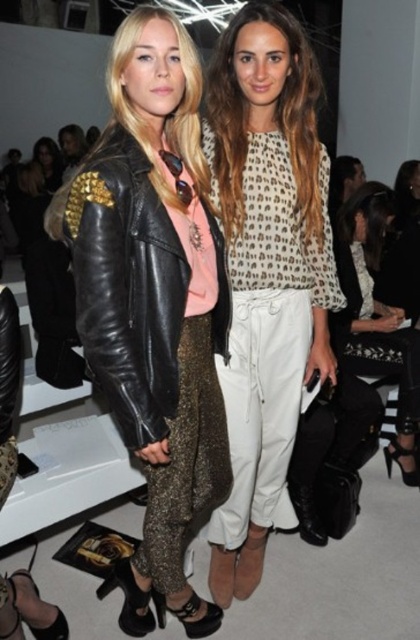
You are a fashion designer trying to decide which piece to feature in your upcoming collection. Both the shiny black leather jacket at center and the printed fabric blouse at center are contenders. Based on their size, which one would you choose if you want a more impactful statement piece?

The shiny black leather jacket at center is bigger than the printed fabric blouse at center, so it would make a more impactful statement piece due to its larger size.